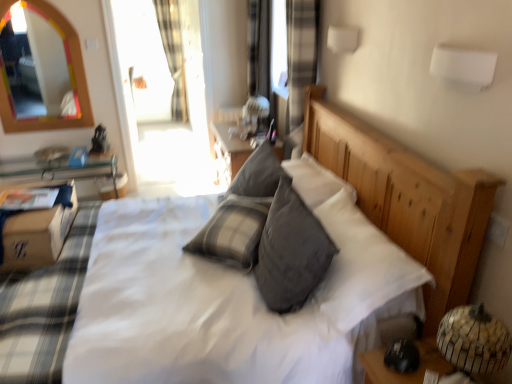
Question: Looking at their shapes, would you say white cotton bedspread at left is wider or thinner than brown cardboard box at lower left?

Choices:
 (A) thin
 (B) wide

Answer: (B)

Question: Is white cotton bedspread at left taller or shorter than brown cardboard box at lower left?

Choices:
 (A) short
 (B) tall

Answer: (B)

Question: Based on their relative distances, which object is farther from the rainbow-colored wooden mirror at upper left?

Choices:
 (A) gray soft pillow at center
 (B) plaid fabric curtain at upper left
 (C) matte white table lamp at center
 (D) white cotton bedspread at left
 (E) transparent glass door at upper center

Answer: (A)

Question: Based on their relative distances, which object is nearer to the gray soft pillow at center?

Choices:
 (A) transparent glass door at upper center
 (B) white cotton bedspread at left
 (C) brown cardboard box at lower left
 (D) rainbow-colored wooden mirror at upper left
 (E) plaid fabric curtain at upper left

Answer: (B)